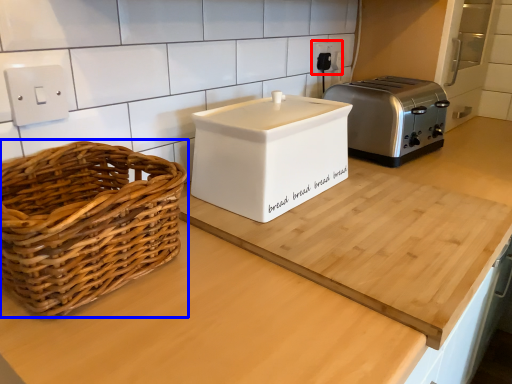
Question: Which object appears farthest to the camera in this image, electric outlet (highlighted by a red box) or picnic basket (highlighted by a blue box)?

Choices:
 (A) electric outlet
 (B) picnic basket

Answer: (A)